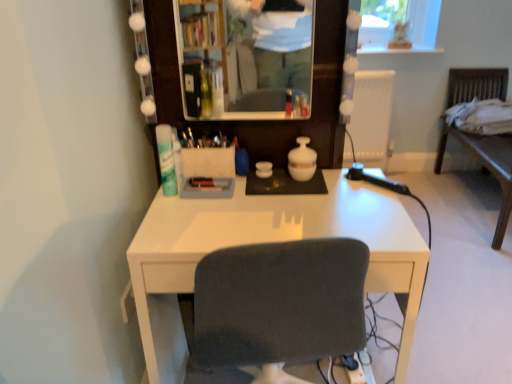
Describe the element at coordinates (166, 159) in the screenshot. The height and width of the screenshot is (384, 512). I see `white matte deodorant at left` at that location.

What do you see at coordinates (372, 117) in the screenshot? I see `white plastic radiator at upper right` at bounding box center [372, 117].

Measure the distance between white plastic radiator at upper right and camera.

The depth of white plastic radiator at upper right is 9.02 feet.

Locate an element on the screen. white glossy desk at center is located at coordinates (265, 242).

Does white plastic radiator at upper right have a greater width compared to white matte deodorant at left?

Correct, the width of white plastic radiator at upper right exceeds that of white matte deodorant at left.

How different are the orientations of white plastic radiator at upper right and white matte deodorant at left in degrees?

0.485 degrees separate the facing orientations of white plastic radiator at upper right and white matte deodorant at left.

Would you say white plastic radiator at upper right contains white matte deodorant at left?

That's incorrect, white matte deodorant at left is not inside white plastic radiator at upper right.

From the image's perspective, would you say white plastic radiator at upper right is positioned over white matte deodorant at left?

Yes.

From the image's perspective, which object appears higher, white matte deodorant at left or white glossy desk at center?

white matte deodorant at left, from the image's perspective.

From a real-world perspective, is white matte deodorant at left located higher than white glossy desk at center?

Indeed, from a real-world perspective, white matte deodorant at left stands above white glossy desk at center.

In the image, is white matte deodorant at left positioned in front of or behind white glossy desk at center?

white matte deodorant at left is behind white glossy desk at center.

Which object is positioned more to the right, white matte deodorant at left or white glossy desk at center?

white glossy desk at center.

Does matte glass mirror at upper center have a larger size compared to wooden chair at right?

No, matte glass mirror at upper center is not bigger than wooden chair at right.

Relative to wooden chair at right, is matte glass mirror at upper center in front or behind?

In the image, matte glass mirror at upper center appears in front of wooden chair at right.

Considering the points (248, 108) and (499, 91), which point is behind, point (248, 108) or point (499, 91)?

The point (499, 91) is farther.

In terms of size, does white plastic radiator at upper right appear bigger or smaller than wooden chair at right?

Considering their sizes, white plastic radiator at upper right takes up less space than wooden chair at right.

From a real-world perspective, which object stands above the other?

white plastic radiator at upper right.

Locate an element on the screen. furniture in front of the white plastic radiator at upper right is located at coordinates (486, 167).

Is white glossy desk at center spatially inside white matte deodorant at left, or outside of it?

white glossy desk at center exists outside the volume of white matte deodorant at left.

From the image's perspective, relative to white matte deodorant at left, is white glossy desk at center above or below?

white glossy desk at center is below white matte deodorant at left.

Does point (418, 246) come closer to viewer compared to point (175, 172)?

Yes, it is.

Which object is further away from the camera taking this photo, matte glass mirror at upper center or white plastic radiator at upper right?

white plastic radiator at upper right is further from the camera.

Based on their sizes in the image, would you say matte glass mirror at upper center is bigger or smaller than white plastic radiator at upper right?

→ matte glass mirror at upper center is smaller than white plastic radiator at upper right.

From the picture: Could you tell me if matte glass mirror at upper center is turned towards white plastic radiator at upper right?

No, matte glass mirror at upper center is not oriented towards white plastic radiator at upper right.

Can you see white matte deodorant at left touching matte glass mirror at upper center?

white matte deodorant at left and matte glass mirror at upper center are clearly separated.

Which object is positioned more to the left, white matte deodorant at left or matte glass mirror at upper center?

white matte deodorant at left.

Does white matte deodorant at left have a smaller size compared to matte glass mirror at upper center?

Yes, white matte deodorant at left is smaller than matte glass mirror at upper center.

Where is `toiletry below the white plastic radiator at upper right (from the image's perspective)`? toiletry below the white plastic radiator at upper right (from the image's perspective) is located at coordinates (166, 159).

Identify the location of toiletry above the white glossy desk at center (from a real-world perspective). (166, 159).

Looking at the image, which one is located closer to white plastic radiator at upper right, white matte deodorant at left or white glossy desk at center?

white glossy desk at center lies closer to white plastic radiator at upper right than the other object.

Which object lies further to the anchor point white plastic radiator at upper right, matte glass mirror at upper center or white glossy desk at center?

Among the two, white glossy desk at center is located further to white plastic radiator at upper right.

Which object lies nearer to the anchor point white matte deodorant at left, white plastic radiator at upper right or wooden chair at right?

wooden chair at right is positioned closer to the anchor white matte deodorant at left.

From the image, which object appears to be farther from wooden chair at right, white matte deodorant at left or matte glass mirror at upper center?

Based on the image, white matte deodorant at left appears to be further to wooden chair at right.

From the image, which object appears to be farther from white plastic radiator at upper right, matte glass mirror at upper center or wooden chair at right?

matte glass mirror at upper center is positioned further to the anchor white plastic radiator at upper right.

Looking at the image, which one is located closer to white glossy desk at center, white matte deodorant at left or white plastic radiator at upper right?

white matte deodorant at left is closer to white glossy desk at center.

When comparing their distances from white glossy desk at center, does matte glass mirror at upper center or white plastic radiator at upper right seem closer?

matte glass mirror at upper center lies closer to white glossy desk at center than the other object.

When comparing their distances from white matte deodorant at left, does wooden chair at right or white glossy desk at center seem closer?

white glossy desk at center lies closer to white matte deodorant at left than the other object.

Where is `mirror between white glossy desk at center and white plastic radiator at upper right in the front-back direction`? This screenshot has height=384, width=512. mirror between white glossy desk at center and white plastic radiator at upper right in the front-back direction is located at coordinates (249, 55).

I want to click on furniture positioned between matte glass mirror at upper center and white plastic radiator at upper right from near to far, so click(x=486, y=167).

Where is `desk located between matte glass mirror at upper center and wooden chair at right in the left-right direction`? The height and width of the screenshot is (384, 512). desk located between matte glass mirror at upper center and wooden chair at right in the left-right direction is located at coordinates (265, 242).

Locate an element on the screen. This screenshot has width=512, height=384. desk between white matte deodorant at left and wooden chair at right is located at coordinates (265, 242).